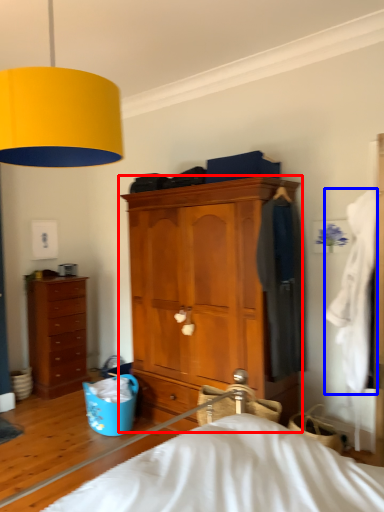
Question: Which point is further to the camera, chest of drawers (highlighted by a red box) or clothing (highlighted by a blue box)?

Choices:
 (A) chest of drawers
 (B) clothing

Answer: (A)